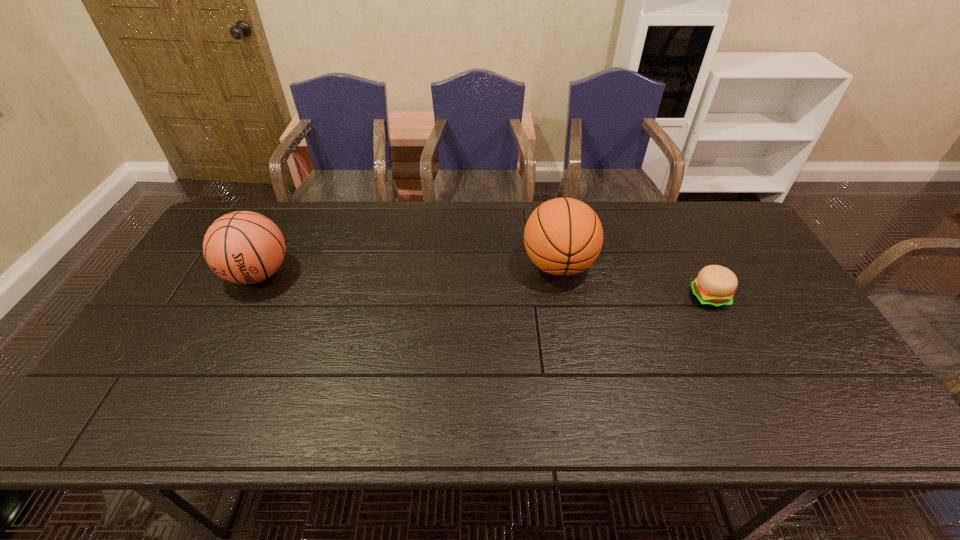
You are a GUI agent. You are given a task and a screenshot of the screen. Output one action in this format:
    pyautogui.click(x=<x>, y=<y>)
    Task: Click on the right basketball
    Image resolution: width=960 pixels, height=540 pixels.
    Given the screenshot: What is the action you would take?
    pyautogui.click(x=563, y=236)

The width and height of the screenshot is (960, 540). What are the coordinates of `the leftmost object` in the screenshot? It's located at (243, 247).

You are a GUI agent. You are given a task and a screenshot of the screen. Output one action in this format:
    pyautogui.click(x=<x>, y=<y>)
    Task: Click on the hamburger
    This screenshot has width=960, height=540.
    Given the screenshot: What is the action you would take?
    click(x=714, y=287)

The height and width of the screenshot is (540, 960). I want to click on the shortest object, so click(x=714, y=287).

Find the location of a particular element. This screenshot has height=540, width=960. free space located 0.380m on the front of the second object from right to left is located at coordinates (586, 417).

The width and height of the screenshot is (960, 540). What are the coordinates of `free spot located on the surface of the leftmost object near the brand logo` in the screenshot? It's located at (184, 420).

The image size is (960, 540). Find the location of `vacant area located 0.060m on the right of the rightmost object`. vacant area located 0.060m on the right of the rightmost object is located at coordinates 749,297.

Where is `object that is at the far edge`? This screenshot has width=960, height=540. object that is at the far edge is located at coordinates (563, 236).

Locate an element on the screen. The height and width of the screenshot is (540, 960). object present at the left edge is located at coordinates (243, 247).

Identify the location of vacant area at the far edge. (396, 211).